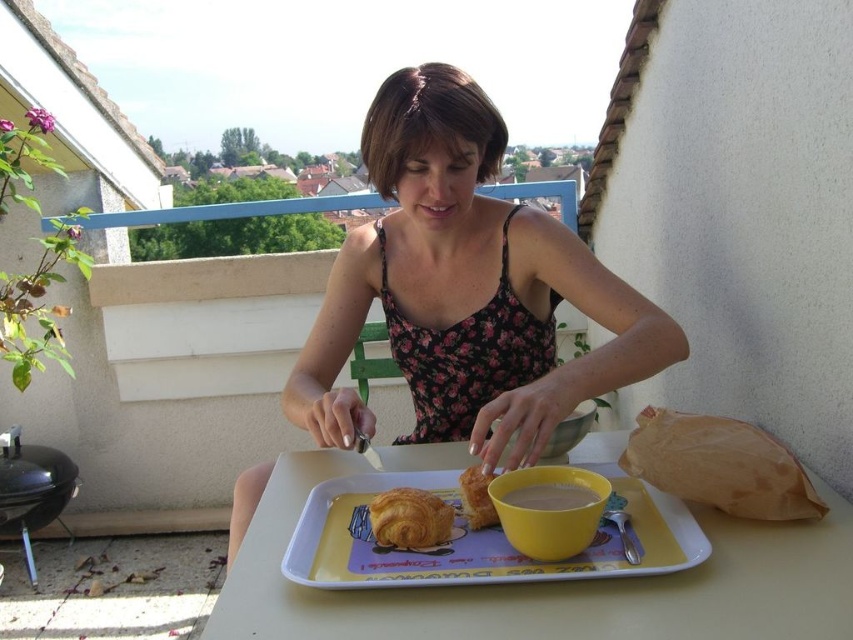
Question: Is floral fabric dress at center below golden flaky croissant at center?

Choices:
 (A) no
 (B) yes

Answer: (A)

Question: Which object is the farthest from the golden brown flaky croissant at center?

Choices:
 (A) white plastic tray at center
 (B) golden flaky croissant at center

Answer: (A)

Question: Which point is farther to the camera?

Choices:
 (A) golden flaky croissant at center
 (B) matte yellow cup at center
 (C) floral fabric dress at center

Answer: (C)

Question: Which point is farther from the camera taking this photo?

Choices:
 (A) pyautogui.click(x=339, y=545)
 (B) pyautogui.click(x=480, y=500)
 (C) pyautogui.click(x=403, y=545)

Answer: (B)

Question: Can you confirm if floral fabric dress at center is positioned to the right of yellow plastic tray at center?

Choices:
 (A) no
 (B) yes

Answer: (A)

Question: Is white plastic tray at center further to the viewer compared to matte yellow cup at center?

Choices:
 (A) yes
 (B) no

Answer: (B)